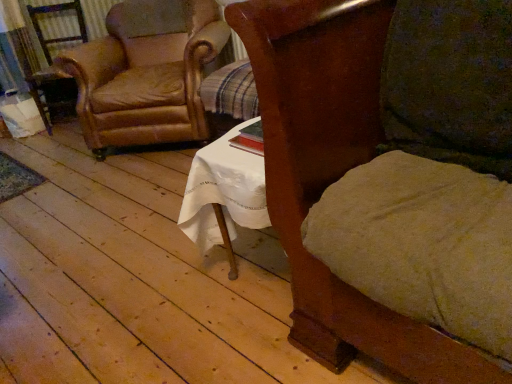
Question: Would you say wooden chair at center, the 2th chair from the left, is to the left or to the right of leather at left, acting as the second chair starting from the right, in the picture?

Choices:
 (A) left
 (B) right

Answer: (B)

Question: From a real-world perspective, is wooden chair at center, which appears as the second chair when viewed from the back, positioned above or below leather at left, the second chair when ordered from front to back?

Choices:
 (A) below
 (B) above

Answer: (B)

Question: Which of these objects is positioned closest to the leather armchair at left?

Choices:
 (A) wooden chair at center, the 2th chair from the left
 (B) leather at left, the second chair when ordered from front to back

Answer: (B)

Question: Considering the real-world distances, which object is farthest from the leather at left, arranged as the first chair when viewed from the back?

Choices:
 (A) wooden chair at center, which appears as the second chair when viewed from the back
 (B) leather armchair at left

Answer: (A)